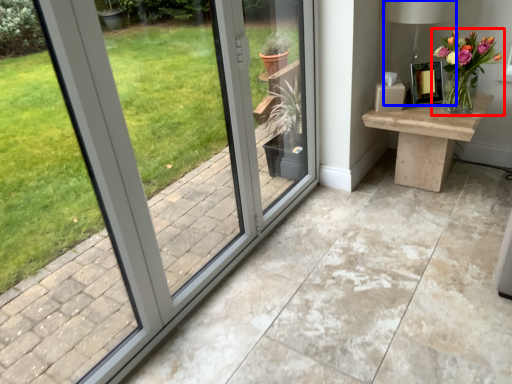
Question: Which point is closer to the camera, houseplant (highlighted by a red box) or table lamp (highlighted by a blue box)?

Choices:
 (A) houseplant
 (B) table lamp

Answer: (A)